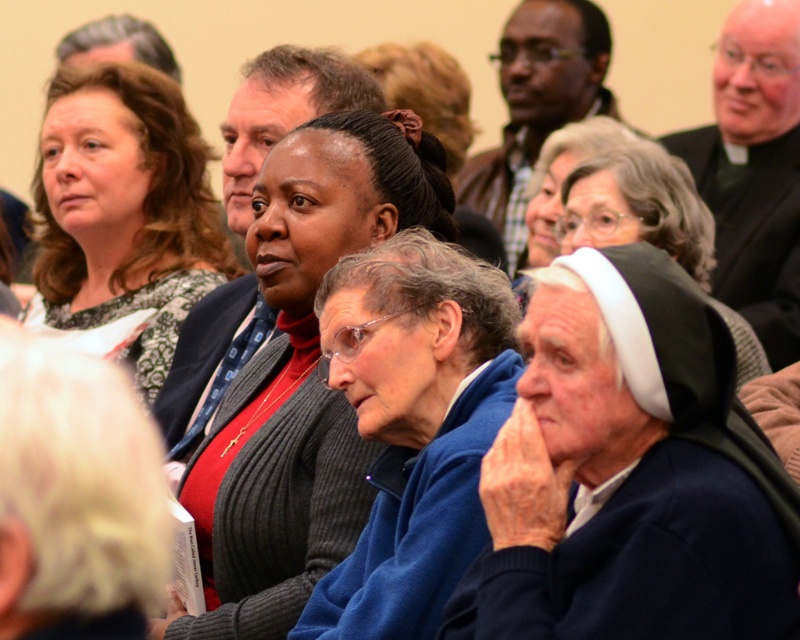
You are organizing a clothing donation drive and need to categorize items by size. You have two sweaters in front of you, the knitted sweater at center and the matte black sweater at upper left. Based on their widths, which one should be placed in the small size bin?

The knitted sweater at center has a lesser width compared to the matte black sweater at upper left, so it should be placed in the small size bin.

You are organizing a charity event and need to determine if a donated knitted sweater at center can fit into a storage box designed for the matte black jacket at upper center. Based on their sizes, will the sweater fit?

The knitted sweater at center is smaller than the matte black jacket at upper center, so the sweater should fit into the storage box designed for the jacket.

You are organizing a coat rack for an event and need to hang the knitted sweater at center and the matte black jacket at upper center. Which item should you place higher on the rack to ensure both items are visible?

The knitted sweater at center is shorter than the matte black jacket at upper center, so placing the knitted sweater at center higher up on the rack will ensure both items are visible without being obscured by the taller jacket.